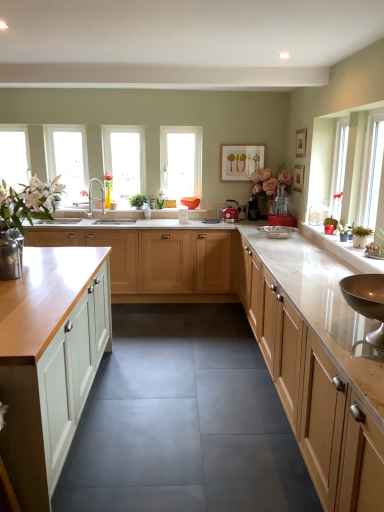
I want to click on wooden picture frame at upper center, which appears as the 2th picture frame when viewed from the front, so click(x=298, y=177).

Describe the element at coordinates (159, 262) in the screenshot. I see `light wood cabinet at center, acting as the 2th cabinetry starting from the left` at that location.

In order to click on white matte picture frame at upper center, marked as the first picture frame in a left-to-right arrangement in this screenshot , I will do `click(241, 161)`.

Considering the positions of point (303, 134) and point (176, 158), is point (303, 134) closer or farther from the camera than point (176, 158)?

Point (303, 134) appears to be closer to the viewer than point (176, 158).

Can you confirm if white matte picture frame at upper center, which is the first picture frame from front to back, is smaller than translucent glass window at center?

Yes.

Is white matte picture frame at upper center, the 2th picture frame viewed from the right, facing away from translucent glass window at center?

white matte picture frame at upper center, the 2th picture frame viewed from the right, does not have its back to translucent glass window at center.

Can you see white matte picture frame at upper center, the 2th picture frame viewed from the right, touching translucent glass window at center?

white matte picture frame at upper center, the 2th picture frame viewed from the right, and translucent glass window at center are clearly separated.

Between white painted wood cabinet at left, which ranks as the 3th cabinetry in right-to-left order, and clear glass window at center, which is counted as the third window, starting from the left, which one has smaller size?

clear glass window at center, which is counted as the third window, starting from the left.

Is white painted wood cabinet at left, placed as the first cabinetry when sorted from left to right, looking in the opposite direction of clear glass window at center, which appears as the 1th window when viewed from the right?

No, clear glass window at center, which appears as the 1th window when viewed from the right, is not at the back of white painted wood cabinet at left, placed as the first cabinetry when sorted from left to right.

From the image's perspective, is white painted wood cabinet at left, placed as the first cabinetry when sorted from left to right, above or below clear glass window at center, which is counted as the third window, starting from the left?

From the image's perspective, white painted wood cabinet at left, placed as the first cabinetry when sorted from left to right, appears below clear glass window at center, which is counted as the third window, starting from the left.

Between point (271, 225) and point (226, 153), which one is positioned in front?

The point (271, 225) is closer to the camera.

Consider the image. Considering the sizes of objects red plastic food processor at center, which appears as the 3th appliance when viewed from the left, and white matte picture frame at upper center, the 3th picture frame in the front-to-back sequence, in the image provided, who is thinner, red plastic food processor at center, which appears as the 3th appliance when viewed from the left, or white matte picture frame at upper center, the 3th picture frame in the front-to-back sequence,?

With smaller width is white matte picture frame at upper center, the 3th picture frame in the front-to-back sequence.

Based on the photo, is red plastic food processor at center, placed as the 3th appliance when sorted from back to front, facing towards white matte picture frame at upper center, acting as the third picture frame starting from the right?

No, red plastic food processor at center, placed as the 3th appliance when sorted from back to front, does not turn towards white matte picture frame at upper center, acting as the third picture frame starting from the right.

Are clear glass window at left, marked as the third window in a right-to-left arrangement, and green leafy plant at center beside each other?

clear glass window at left, marked as the third window in a right-to-left arrangement, is not next to green leafy plant at center, and they're not touching.

Is clear glass window at left, marked as the first window in a left-to-right arrangement, wider or thinner than green leafy plant at center?

clear glass window at left, marked as the first window in a left-to-right arrangement, is thinner than green leafy plant at center.

In terms of height, does clear glass window at left, marked as the first window in a left-to-right arrangement, look taller or shorter compared to green leafy plant at center?

In the image, clear glass window at left, marked as the first window in a left-to-right arrangement, appears to be taller than green leafy plant at center.

Could green leafy plant at center be considered to be inside clear glass window at left, marked as the third window in a right-to-left arrangement?

No, green leafy plant at center is located outside of clear glass window at left, marked as the third window in a right-to-left arrangement.

Which object is positioned more to the right, wooden picture frame at upper center, which appears as the 2th picture frame when viewed from the front, or white matte vase at left?

Positioned to the right is wooden picture frame at upper center, which appears as the 2th picture frame when viewed from the front.

Which object is more forward, wooden picture frame at upper center, which appears as the 1th picture frame when viewed from the right, or white matte vase at left?

white matte vase at left is closer to the camera.

Is wooden picture frame at upper center, which appears as the 2th picture frame when viewed from the front, far from white matte vase at left?

wooden picture frame at upper center, which appears as the 2th picture frame when viewed from the front, is far away from white matte vase at left.

Considering the sizes of objects wooden picture frame at upper center, which ranks as the 3th picture frame in left-to-right order, and white matte vase at left in the image provided, who is smaller, wooden picture frame at upper center, which ranks as the 3th picture frame in left-to-right order, or white matte vase at left?

Smaller between the two is wooden picture frame at upper center, which ranks as the 3th picture frame in left-to-right order.

Can you confirm if green leafy plant at center is smaller than white marble countertop at center?

Answer: Indeed, green leafy plant at center has a smaller size compared to white marble countertop at center.

Locate an element on the screen. This screenshot has width=384, height=512. plant above the white marble countertop at center (from the image's perspective) is located at coordinates [137, 200].

From a real-world perspective, which is physically below, green leafy plant at center or white marble countertop at center?

In real-world perspective, white marble countertop at center is lower.

Is green leafy plant at center facing away from white marble countertop at center?

No, white marble countertop at center is not at the back of green leafy plant at center.

Considering the sizes of objects translucent glass window at center and wooden picture frame at upper center, which appears as the 2th picture frame when viewed from the front, in the image provided, who is bigger, translucent glass window at center or wooden picture frame at upper center, which appears as the 2th picture frame when viewed from the front,?

With larger size is translucent glass window at center.

From the image's perspective, is translucent glass window at center located above or below wooden picture frame at upper center, the second picture frame positioned from the back?

From the image's perspective, translucent glass window at center appears above wooden picture frame at upper center, the second picture frame positioned from the back.

Which of these two, translucent glass window at center or wooden picture frame at upper center, which appears as the 1th picture frame when viewed from the right, stands shorter?

wooden picture frame at upper center, which appears as the 1th picture frame when viewed from the right, is shorter.

Based on the photo, which object is wider, translucent glass window at center or wooden picture frame at upper center, the second picture frame positioned from the back?

translucent glass window at center.

This screenshot has width=384, height=512. I want to click on the 2nd picture frame positioned above the translucent glass window at center (from a real-world perspective), so point(301,142).

Identify the location of window on the right side of white painted wood cabinet at left, placed as the first cabinetry when sorted from left to right. This screenshot has height=512, width=384. (125, 160).

Estimate the real-world distances between objects in this image. Which object is further from clear glass window at left, marked as the third window in a right-to-left arrangement, green leafy plant at center or red plastic food processor at center, which ranks as the 1th appliance in front-to-back order?

red plastic food processor at center, which ranks as the 1th appliance in front-to-back order.

When comparing their distances from red plastic food processor at center, which ranks as the 1th appliance in front-to-back order, does clear glass window at center, which appears as the 1th window when viewed from the right, or translucent glass window at center seem closer?

translucent glass window at center is positioned closer to the anchor red plastic food processor at center, which ranks as the 1th appliance in front-to-back order.

Estimate the real-world distances between objects in this image. Which object is closer to white matte vase at left, wooden picture frame at upper center, which appears as the 1th picture frame when viewed from the right, or light wood cabinet at center, the 2th cabinetry when ordered from right to left?

light wood cabinet at center, the 2th cabinetry when ordered from right to left.

From the image, which object appears to be farther from clear glass window at center, which appears as the 1th window when viewed from the right, red plastic food processor at center, which appears as the 3th appliance when viewed from the left, or white painted wood cabinet at left, which ranks as the 3th cabinetry in right-to-left order?

white painted wood cabinet at left, which ranks as the 3th cabinetry in right-to-left order, is positioned further to the anchor clear glass window at center, which appears as the 1th window when viewed from the right.

When comparing their distances from white matte picture frame at upper center, the 2th picture frame viewed from the right, does matte red kettle at center, which is counted as the second appliance, starting from the back, or clear glass window at center, which appears as the 1th window when viewed from the right, seem further?

Among the two, clear glass window at center, which appears as the 1th window when viewed from the right, is located further to white matte picture frame at upper center, the 2th picture frame viewed from the right.

In the scene shown: Estimate the real-world distances between objects in this image. Which object is further from light wood cabinet at center, the 2th cabinetry when ordered from right to left, red plastic food processor at center, which appears as the 3th appliance when viewed from the left, or green leafy plant at center?

green leafy plant at center is positioned further to the anchor light wood cabinet at center, the 2th cabinetry when ordered from right to left.

Which object lies nearer to the anchor point clear glass window at center, which is counted as the third window, starting from the left, white matte picture frame at upper center, the 3th picture frame in the front-to-back sequence, or metallic silver kettle at center, the second appliance viewed from the left?

white matte picture frame at upper center, the 3th picture frame in the front-to-back sequence, is positioned closer to the anchor clear glass window at center, which is counted as the third window, starting from the left.

From the image, which object appears to be nearer to white matte picture frame at upper center, which appears as the third picture frame when viewed from the back, translucent glass window at center or red plastic food processor at center, marked as the first appliance in a right-to-left arrangement?

red plastic food processor at center, marked as the first appliance in a right-to-left arrangement.

The height and width of the screenshot is (512, 384). I want to click on window between clear glass window at upper left, positioned as the 2th window in right-to-left order, and matte red kettle at center, the 1th appliance from the left, in the horizontal direction, so click(x=125, y=160).

At what (x,y) coordinates should I click in order to perform the action: click on picture frame positioned between white matte picture frame at upper center, which appears as the third picture frame when viewed from the back, and white matte picture frame at upper center, acting as the third picture frame starting from the right, from near to far. Please return your answer as a coordinate pair (x, y). This screenshot has width=384, height=512. Looking at the image, I should click on (298, 177).

Where is `plant located between clear glass window at center, which appears as the 1th window when viewed from the right, and red plastic food processor at center, marked as the first appliance in a right-to-left arrangement, in the left-right direction`? plant located between clear glass window at center, which appears as the 1th window when viewed from the right, and red plastic food processor at center, marked as the first appliance in a right-to-left arrangement, in the left-right direction is located at coordinates (137, 200).

Image resolution: width=384 pixels, height=512 pixels. I want to click on floral arrangement between light wood cabinet at right, which is counted as the first cabinetry, starting from the right, and green leafy plant at center, along the z-axis, so (x=29, y=203).